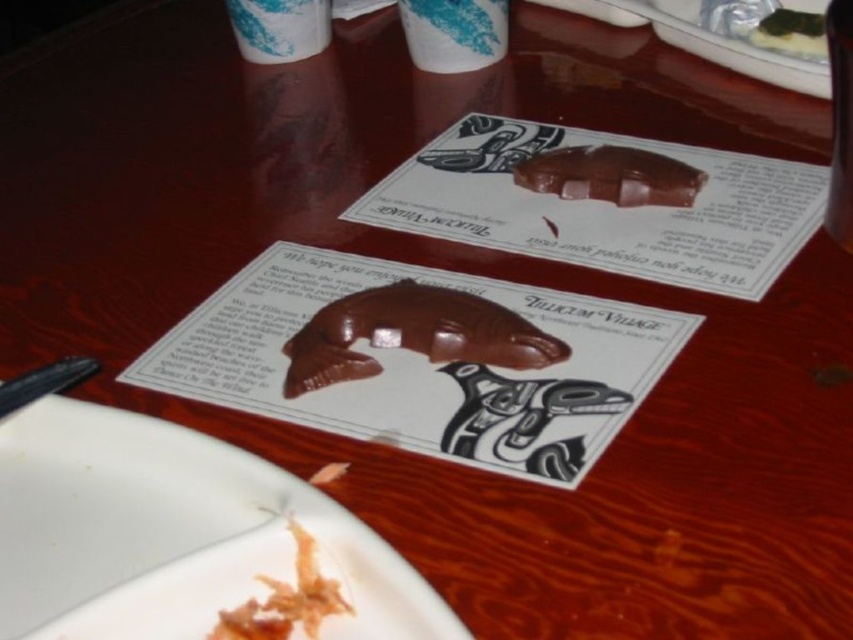
You are a guest at a dinner party and see the shiny brown chocolate at upper center and the shiny brown crumb at lower center on the table. Which item is larger in size?

The shiny brown chocolate at upper center is bigger than the shiny brown crumb at lower center.

You are looking at the wooden table with two carved designs on paper. There are two points marked on the table surface. Which point is closer to you, point (648, 13) or point (318, 604)?

Point (648, 13) is further to the viewer than point (318, 604), so the closer point to you is point (318, 604).